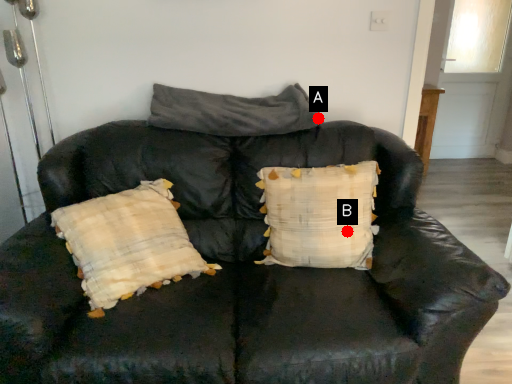
Question: Two points are circled on the image, labeled by A and B beside each circle. Which point appears closest to the camera in this image?

Choices:
 (A) A is closer
 (B) B is closer

Answer: (B)